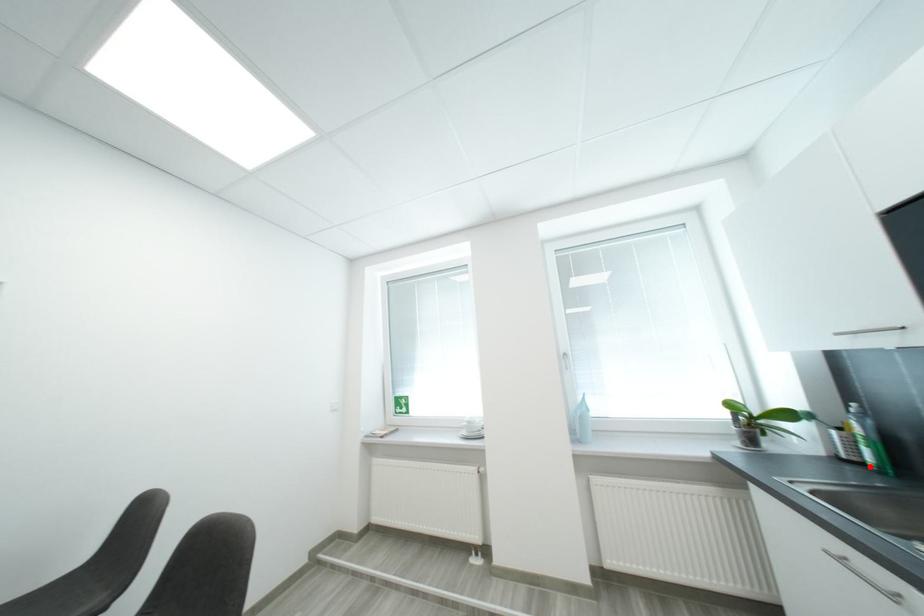
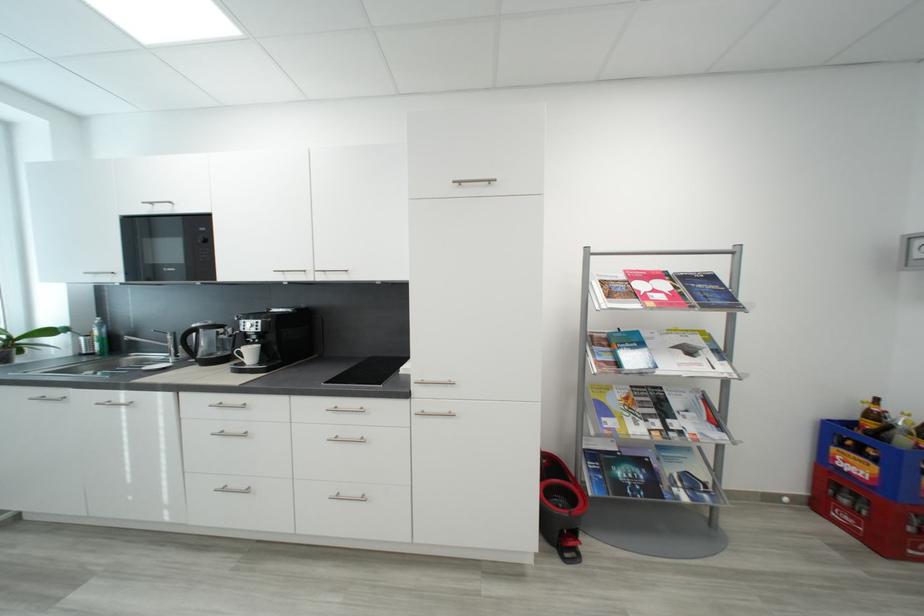
Where in the second image is the point corresponding to the highlighted location from the first image?

(100, 355)